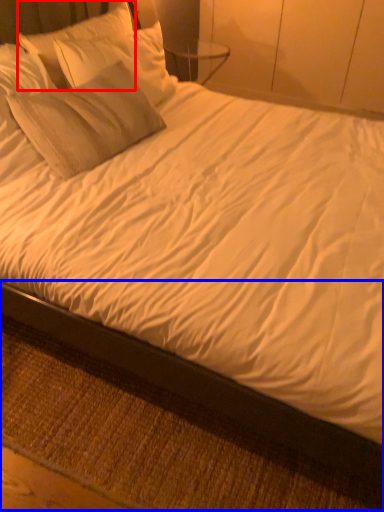
Question: Which object appears farthest to the camera in this image, pillow (highlighted by a red box) or bed frame (highlighted by a blue box)?

Choices:
 (A) pillow
 (B) bed frame

Answer: (A)